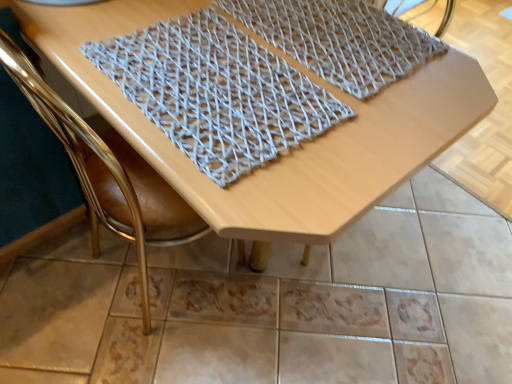
Question: From the image's perspective, would you say gold leather chair at upper left is shown under gray woven mat at upper center, acting as the 1th blanket starting from the right?

Choices:
 (A) yes
 (B) no

Answer: (A)

Question: Is gold leather chair at upper left bigger than gray woven mat at upper center, acting as the 1th blanket starting from the right?

Choices:
 (A) yes
 (B) no

Answer: (A)

Question: From the image's perspective, would you say gold leather chair at upper left is positioned over gray woven mat at upper center, acting as the 1th blanket starting from the right?

Choices:
 (A) yes
 (B) no

Answer: (B)

Question: Is gold leather chair at upper left next to gray woven mat at upper center, which is counted as the second blanket, starting from the left, and touching it?

Choices:
 (A) no
 (B) yes

Answer: (A)

Question: Is gold leather chair at upper left shorter than gray woven mat at upper center, acting as the 1th blanket starting from the right?

Choices:
 (A) no
 (B) yes

Answer: (A)

Question: From a real-world perspective, is gold leather chair at upper left physically above gray woven mat at upper center, acting as the 1th blanket starting from the right?

Choices:
 (A) no
 (B) yes

Answer: (A)

Question: Is knitted fabric at center, which ranks as the 2th blanket in right-to-left order, wider than gold leather chair at upper left?

Choices:
 (A) yes
 (B) no

Answer: (B)

Question: Can you confirm if knitted fabric at center, which ranks as the 2th blanket in right-to-left order, is bigger than gold leather chair at upper left?

Choices:
 (A) no
 (B) yes

Answer: (A)

Question: Is knitted fabric at center, which ranks as the 2th blanket in right-to-left order, outside gold leather chair at upper left?

Choices:
 (A) no
 (B) yes

Answer: (A)

Question: From a real-world perspective, is knitted fabric at center, placed as the 1th blanket when sorted from left to right, under gold leather chair at upper left?

Choices:
 (A) yes
 (B) no

Answer: (B)

Question: From a real-world perspective, is knitted fabric at center, placed as the 1th blanket when sorted from left to right, positioned over gold leather chair at upper left based on gravity?

Choices:
 (A) no
 (B) yes

Answer: (B)

Question: Considering the relative sizes of knitted fabric at center, placed as the 1th blanket when sorted from left to right, and gold leather chair at upper left in the image provided, is knitted fabric at center, placed as the 1th blanket when sorted from left to right, smaller than gold leather chair at upper left?

Choices:
 (A) yes
 (B) no

Answer: (A)

Question: From a real-world perspective, is wooden table at center physically above gold leather chair at upper left?

Choices:
 (A) no
 (B) yes

Answer: (A)